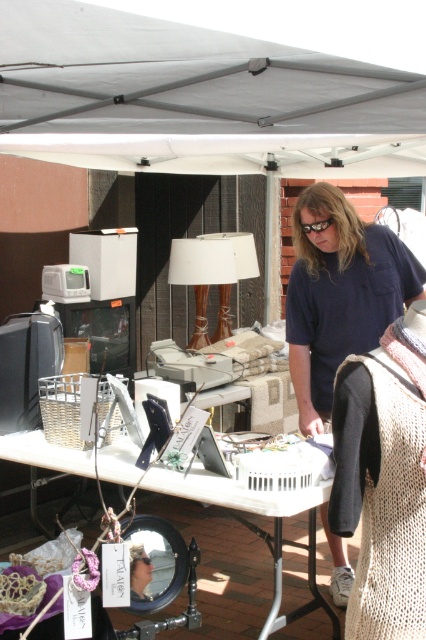
Who is more forward, (x=210, y=141) or (x=275, y=515)?

Point (x=275, y=515) is in front.

Who is higher up, gray fabric canopy at upper center or metallic silver mirror at center?

gray fabric canopy at upper center

Between point (172, 72) and point (270, 499), which one is positioned behind?

Point (172, 72)

Where is `gray fabric canopy at upper center`? This screenshot has width=426, height=640. gray fabric canopy at upper center is located at coordinates (195, 99).

Which is in front, point (259, 157) or point (405, 285)?

Positioned in front is point (405, 285).

Is point (203, 132) positioned before point (302, 372)?

Yes, it is in front of point (302, 372).

Who is more forward, (238, 154) or (377, 273)?

Positioned in front is point (377, 273).

You are a GUI agent. You are given a task and a screenshot of the screen. Output one action in this format:
    pyautogui.click(x=<x>, y=<y>)
    Task: Click on the gray fabric canopy at upper center
    This screenshot has width=426, height=640.
    Given the screenshot: What is the action you would take?
    pyautogui.click(x=195, y=99)

Which of these two, dark blue shirt at center or metallic silver mirror at center, stands shorter?

Standing shorter between the two is metallic silver mirror at center.

Is dark blue shirt at center to the right of metallic silver mirror at center from the viewer's perspective?

Yes, dark blue shirt at center is to the right of metallic silver mirror at center.

Describe the element at coordinates (339, 292) in the screenshot. I see `dark blue shirt at center` at that location.

Locate an element on the screen. This screenshot has width=426, height=640. dark blue shirt at center is located at coordinates (339, 292).